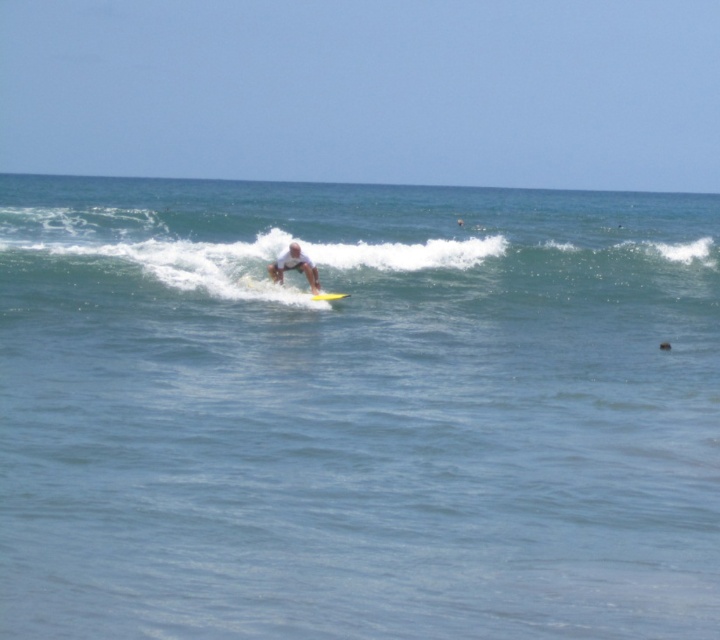
You are a photographer trying to capture the surfer and the surfboard in the image. Which object, the clear blue water at center or the white matte surfboard at center, is positioned closer to the camera?

The clear blue water at center is closer to the viewer than the white matte surfboard at center, so the water would appear closer in the photograph.

You are a photographer trying to capture the surfer on the white matte surfboard at center. To ensure the surfboard is centered in your shot, where should you aim your camera? Specify the coordinates as a point in the format of two numbers between 0 and 1, separated by a comma.

The white matte surfboard at center is located at point (294, 266), so aim your camera at that coordinate to center it in your shot.

You are a drone operator trying to capture the surfer riding the wave. The surfer is at the center of the image. To get a better shot, you need to adjust the drone to focus on the clear blue water at center. Where should you position the drone relative to the surfer?

The clear blue water at center is located at coordinates point (356, 412), so you should position the drone slightly to the right and lower than the surfer to focus on the clear blue water at center.